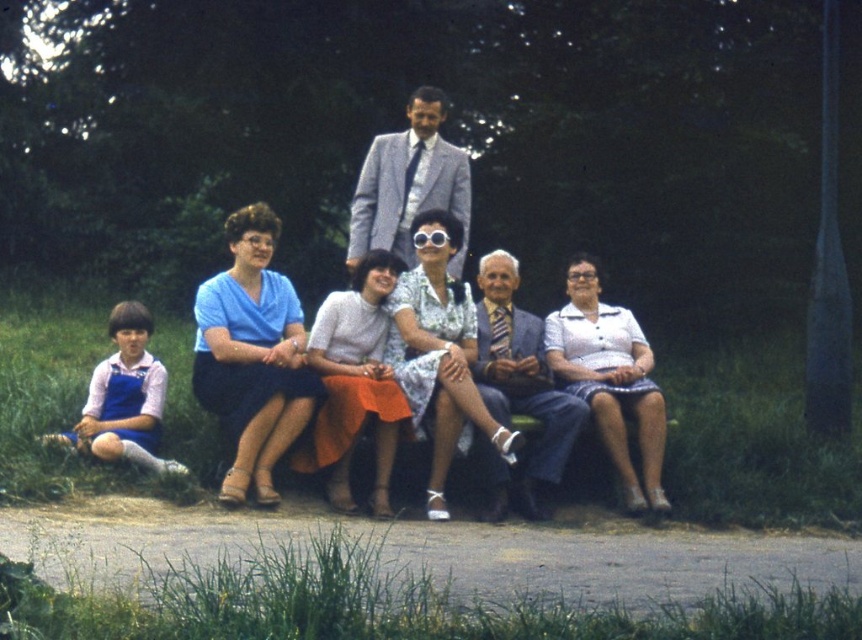
Is blue fabric dress at center behind white textured blouse at center?

No, it is in front of white textured blouse at center.

Between blue fabric dress at center and white textured blouse at center, which one is positioned lower?

Positioned lower is white textured blouse at center.

Image resolution: width=862 pixels, height=640 pixels. I want to click on blue fabric dress at center, so click(253, 356).

Is white textured blouse at center closer to camera compared to light blue fabric suit at center?

No, it is not.

Can you confirm if white textured blouse at center is positioned above light blue fabric suit at center?

Incorrect, white textured blouse at center is not positioned above light blue fabric suit at center.

Is point (561, 339) positioned in front of point (486, 376)?

No.

Where is `white textured blouse at center`? The image size is (862, 640). white textured blouse at center is located at coordinates (609, 380).

Does blue fabric dress at center have a smaller size compared to light blue fabric suit at center?

Actually, blue fabric dress at center might be larger than light blue fabric suit at center.

Does blue fabric dress at center appear under light blue fabric suit at center?

No.

Find the location of a particular element. The height and width of the screenshot is (640, 862). blue fabric dress at center is located at coordinates (253, 356).